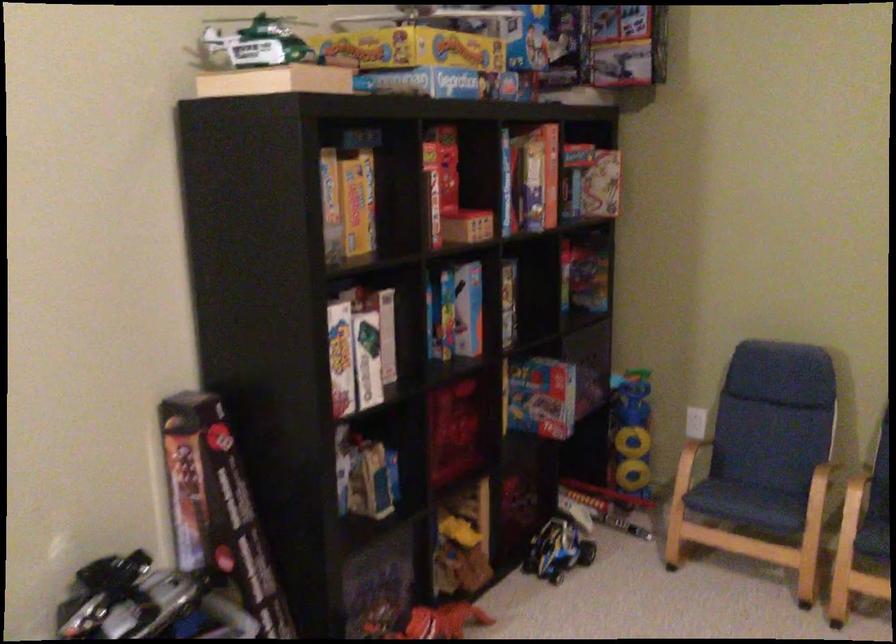
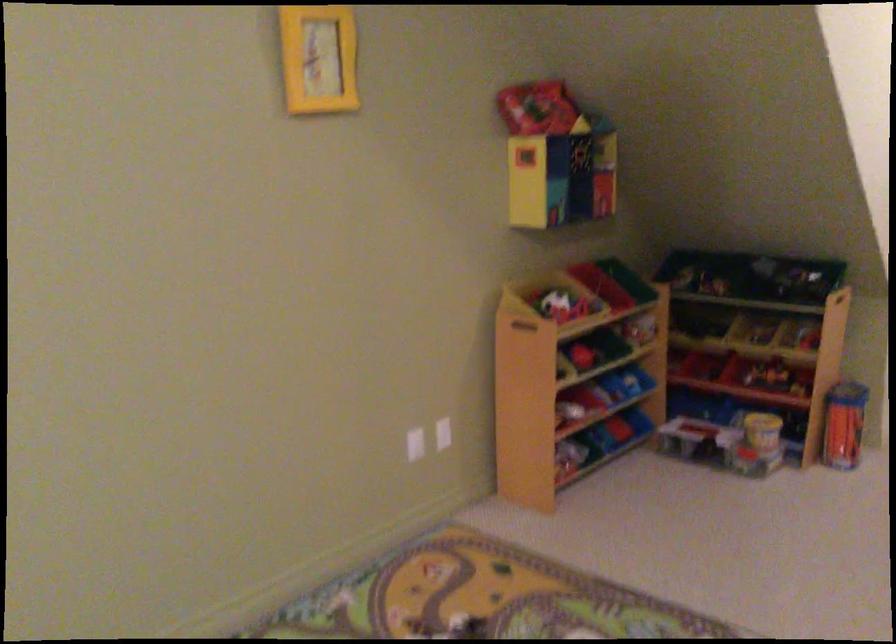
Question: The first image is from the beginning of the video and the second image is from the end. How did the camera likely rotate when shooting the video?

Choices:
 (A) Left
 (B) Right
 (C) Up
 (D) Down

Answer: (B)